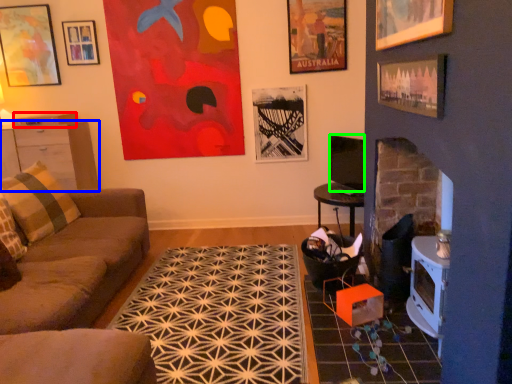
Question: Estimate the real-world distances between objects in this image. Which object is closer to drawer (highlighted by a red box), cabinetry (highlighted by a blue box) or television (highlighted by a green box)?

Choices:
 (A) cabinetry
 (B) television

Answer: (A)